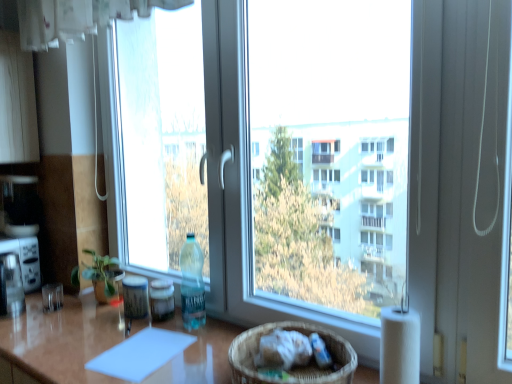
Question: Would you say transparent glass window at center is inside or outside white paper at right?

Choices:
 (A) outside
 (B) inside

Answer: (A)

Question: From a real-world perspective, is transparent glass window at center positioned above or below white paper at right?

Choices:
 (A) below
 (B) above

Answer: (B)

Question: Which object is the farthest from the green matte plant at left?

Choices:
 (A) transparent glass window at center
 (B) woven brown basket at lower center
 (C) white plastic toaster at left
 (D) shiny brown table at center
 (E) white paper at right

Answer: (A)

Question: Which object is positioned closest to the white paper at right?

Choices:
 (A) white plastic toaster at left
 (B) shiny brown table at center
 (C) woven brown basket at lower center
 (D) translucent plastic bottle at center
 (E) transparent glass window at center

Answer: (C)